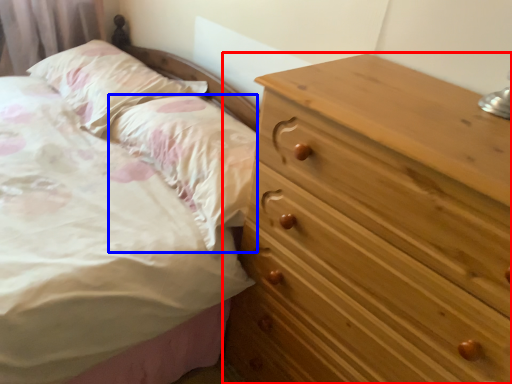
Question: Which of the following is the farthest to the observer, chest of drawers (highlighted by a red box) or pillow (highlighted by a blue box)?

Choices:
 (A) chest of drawers
 (B) pillow

Answer: (B)